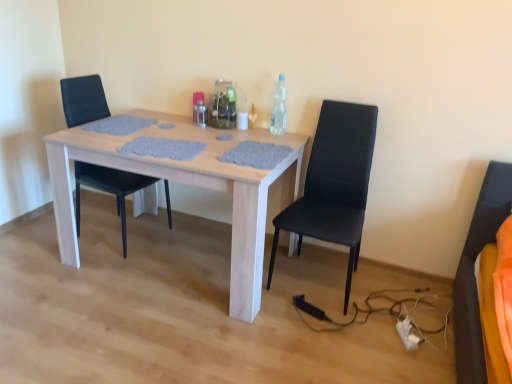
This screenshot has height=384, width=512. What are the coordinates of `blank area beneath black leather chair at right, arranged as the second chair when viewed from the left (from a real-world perspective)` in the screenshot? It's located at coord(321,291).